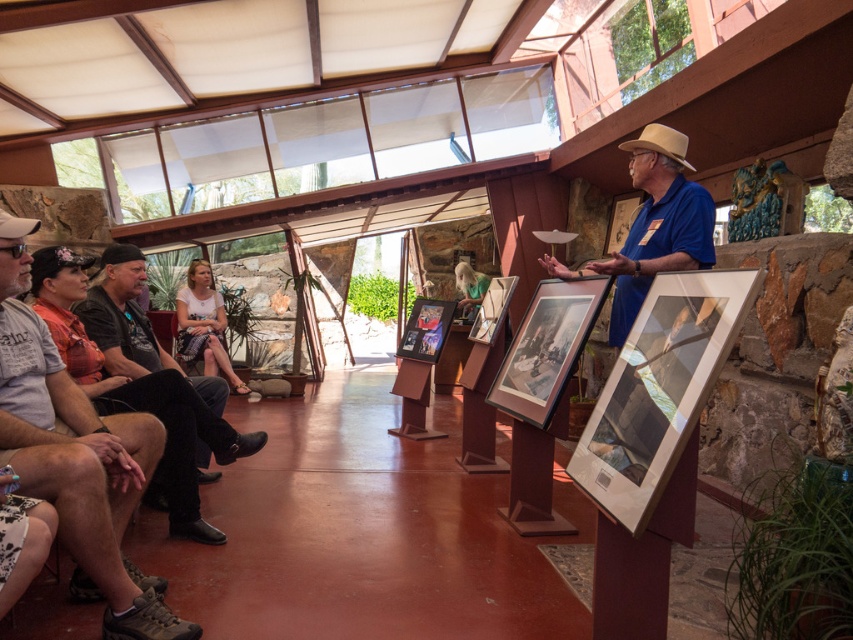
You are a photographer taking a picture of the group in the museum. You notice the gray cotton shirt at left and the blonde hair at center. Which of these two objects would appear bigger in your photo?

The gray cotton shirt at left appears bigger in the photo because it is larger in size than the blonde hair at center.

You are a visitor in the museum and want to take a photo of the framed photographs on stands without anyone blocking the view. The gray cotton shirt at left and blonde hair at center are in your way. Which person should you move first to ensure a clear shot?

The gray cotton shirt at left is in front of blonde hair at center. Since the gray cotton shirt at left is closer to you, you should move them first to ensure the framed photographs on stands are visible without obstruction.

You are an event planner arranging a photo shoot in the museum. You need to position a camera to capture both the blonde hair at center and the matte brown cowboy hat at upper left. Which object should you place the camera to the right of to ensure both are in frame?

You should place the camera to the right of the matte brown cowboy hat at upper left. Since the blonde hair at center is positioned on the right side of the matte brown cowboy hat at upper left, placing the camera to the right of the hat ensures both objects are within the frame.